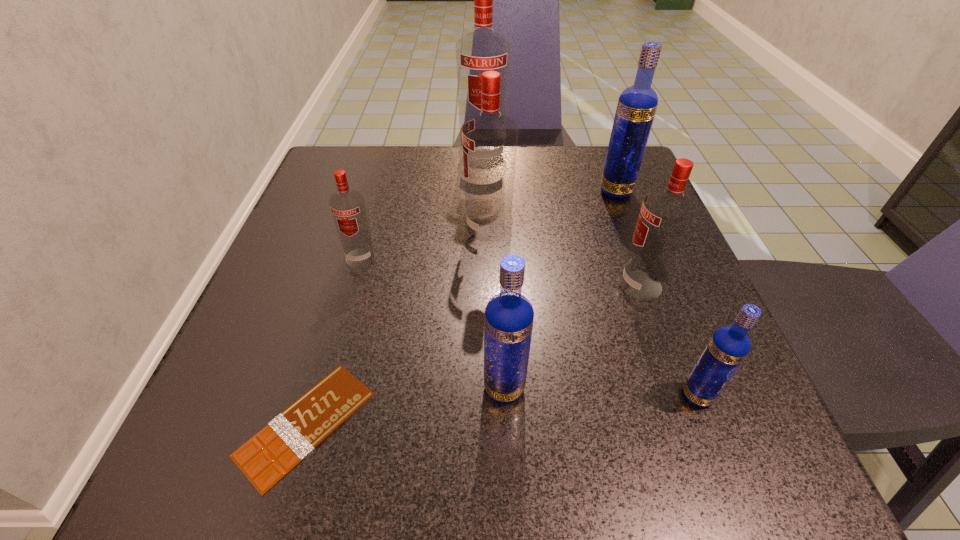
Identify which blue vodka is the nearest to the smallest red vodka. Please provide its 2D coordinates. Your answer should be formatted as a tuple, i.e. [(x, y)], where the tuple contains the x and y coordinates of a point satisfying the conditions above.

[(508, 322)]

At what (x,y) coordinates should I click in order to perform the action: click on free space that satisfies the following two spatial constraints: 1. on the back side of the smallest blue vodka; 2. on the front label of the second biggest red vodka. Please return your answer as a coordinate pair (x, y). Looking at the image, I should click on (634, 230).

The width and height of the screenshot is (960, 540). Identify the location of free space that satisfies the following two spatial constraints: 1. on the front label of the fourth nearest object; 2. on the back side of the smallest blue vodka. (681, 395).

The height and width of the screenshot is (540, 960). In order to click on vacant region that satisfies the following two spatial constraints: 1. on the front label of the sixth nearest object; 2. on the right side of the smallest blue vodka in this screenshot , I will do `click(492, 395)`.

This screenshot has width=960, height=540. I want to click on free region that satisfies the following two spatial constraints: 1. on the front label of the fourth nearest object; 2. on the front side of the chocolate bar, so click(x=690, y=424).

Where is `free space that satisfies the following two spatial constraints: 1. on the front label of the sixth nearest object; 2. on the front label of the smallest red vodka`? This screenshot has width=960, height=540. free space that satisfies the following two spatial constraints: 1. on the front label of the sixth nearest object; 2. on the front label of the smallest red vodka is located at coordinates (490, 258).

I want to click on vacant area that satisfies the following two spatial constraints: 1. on the front side of the leftmost blue vodka; 2. on the right side of the smallest blue vodka, so click(x=505, y=395).

I want to click on blank area in the image that satisfies the following two spatial constraints: 1. on the front label of the smallest blue vodka; 2. on the left side of the farthest red vodka, so [x=485, y=395].